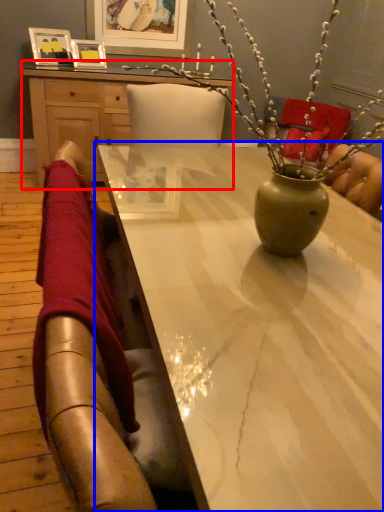
Question: Which point is closer to the camera, desk (highlighted by a red box) or table (highlighted by a blue box)?

Choices:
 (A) desk
 (B) table

Answer: (B)